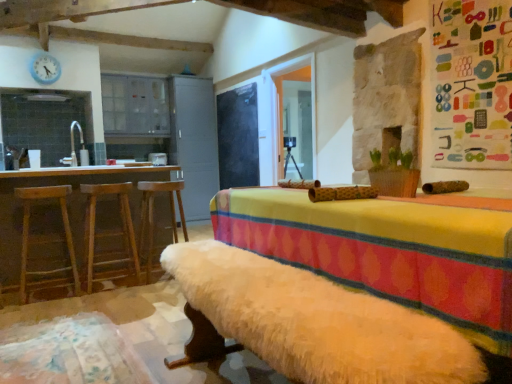
Where is `vacant space in front of wooden bar stool at left, the 1th bar stool from the left`? vacant space in front of wooden bar stool at left, the 1th bar stool from the left is located at coordinates (37, 308).